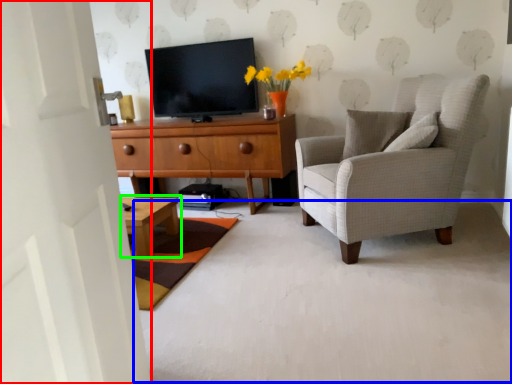
Question: Which is farther away from door (highlighted by a red box)? plain (highlighted by a blue box) or coffee table (highlighted by a green box)?

Choices:
 (A) plain
 (B) coffee table

Answer: (B)